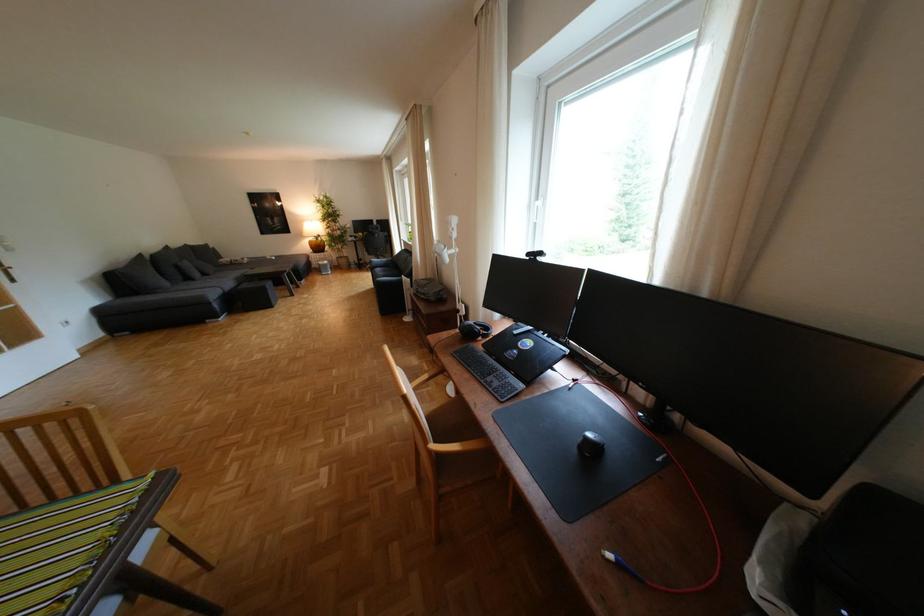
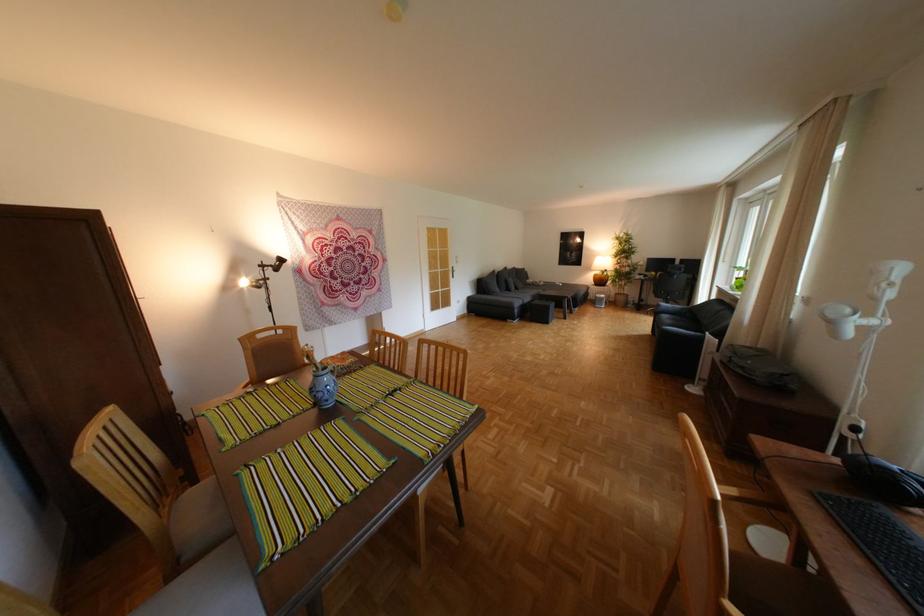
Find the pixel in the second image that matches point 445,447 in the first image.

(744, 608)